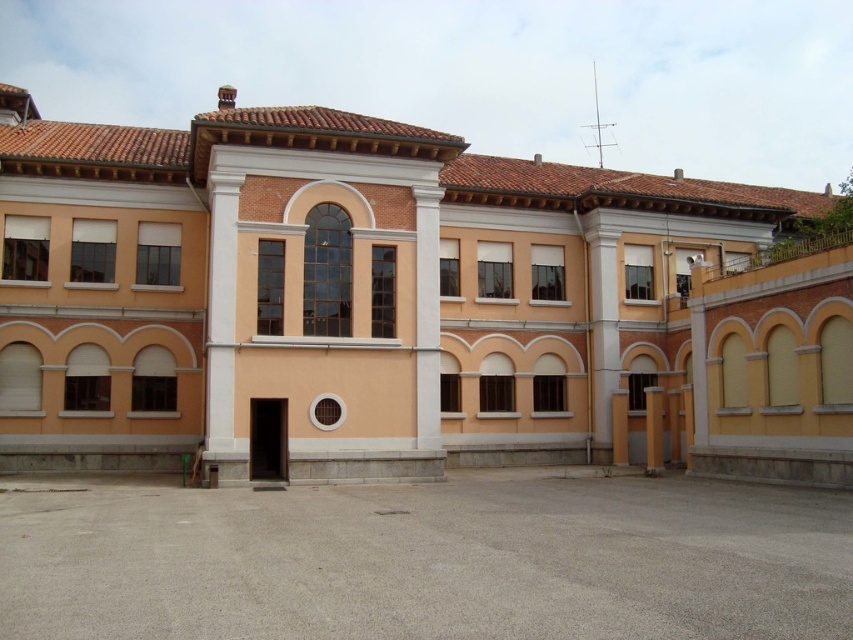
You are standing in front of the two story building and notice two points marked on the facade. The first point is at coordinates point (659, 404) and the second is at point (624, 394). From your perspective, which point appears closer to you?

Point (659, 404) is in front of point (624, 394), so it appears closer to you.

You are an architect evaluating the building structure. You notice the yellow matte pillar at lower right and the yellow concrete pillar at center. Which pillar is shorter in height?

The yellow matte pillar at lower right has a lesser height compared to the yellow concrete pillar at center, so the yellow matte pillar at lower right is shorter.